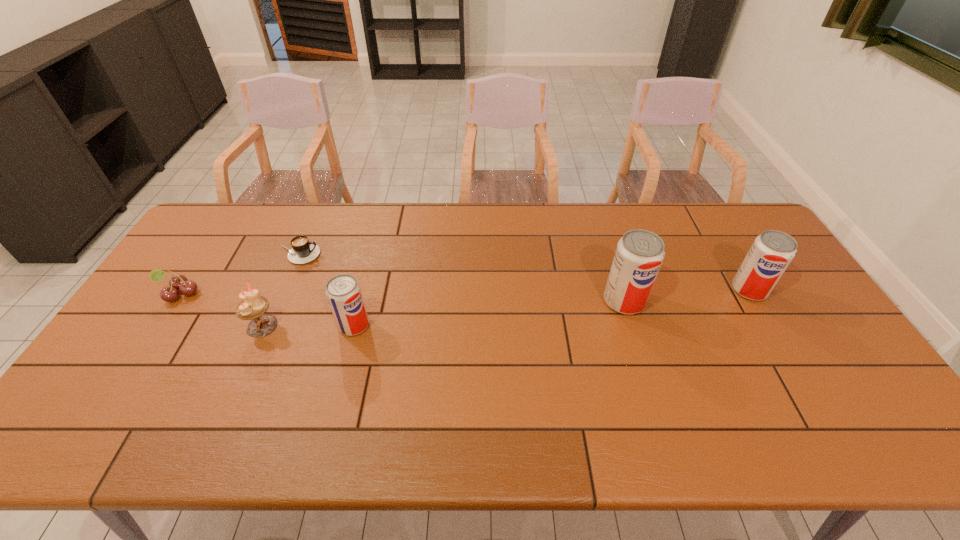
Where is `free space at the near edge of the desktop`? The image size is (960, 540). free space at the near edge of the desktop is located at coordinates click(x=566, y=379).

This screenshot has height=540, width=960. Find the location of `vacant space at the left edge of the desktop`. vacant space at the left edge of the desktop is located at coordinates (161, 321).

You are a GUI agent. You are given a task and a screenshot of the screen. Output one action in this format:
    pyautogui.click(x=<x>, y=<y>)
    Task: Click on the blank space at the far left corner
    The width and height of the screenshot is (960, 540).
    Given the screenshot: What is the action you would take?
    pyautogui.click(x=230, y=227)

You are a GUI agent. You are given a task and a screenshot of the screen. Output one action in this format:
    pyautogui.click(x=<x>, y=<y>)
    Task: Click on the free spot at the near left corner of the desktop
    This screenshot has width=960, height=540.
    Given the screenshot: What is the action you would take?
    pyautogui.click(x=145, y=390)

Locate an element on the screen. The height and width of the screenshot is (540, 960). vacant point located between the fifth tallest object and the second object from right to left is located at coordinates (402, 298).

The image size is (960, 540). I want to click on free space that is in between the leftmost object and the second soda from left to right, so click(402, 298).

I want to click on free space that is in between the cherry and the second tallest soda, so click(x=465, y=292).

I want to click on empty space that is in between the second soda from left to right and the second tallest soda, so click(x=686, y=296).

Where is `unoccupied area between the farthest object and the candle holder`? Image resolution: width=960 pixels, height=540 pixels. unoccupied area between the farthest object and the candle holder is located at coordinates (280, 291).

I want to click on vacant space that is in between the fifth shortest object and the leftmost soda, so click(551, 308).